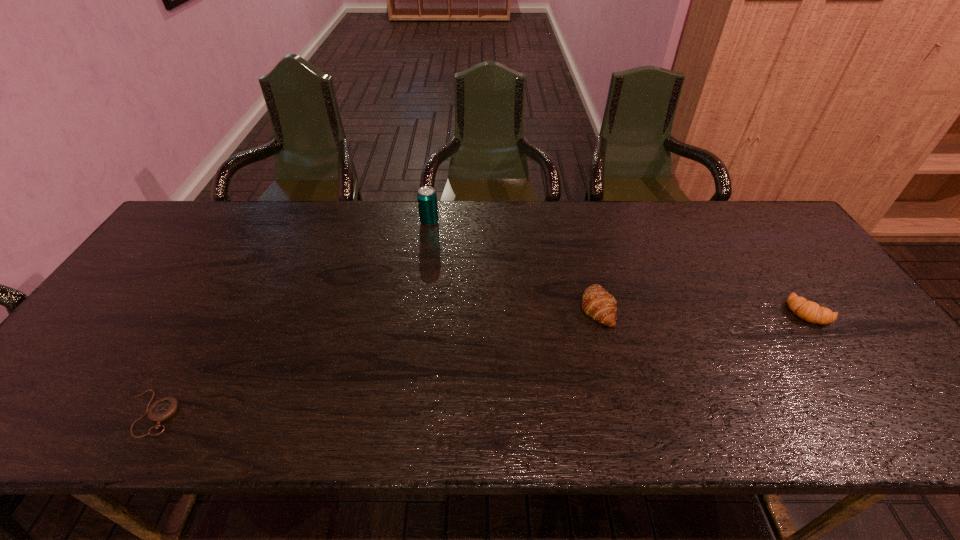
At what (x,y) coordinates should I click in order to perform the action: click on the farthest object. Please return your answer as a coordinate pair (x, y). Looking at the image, I should click on (427, 198).

Image resolution: width=960 pixels, height=540 pixels. I want to click on the tallest object, so click(x=427, y=198).

This screenshot has height=540, width=960. Identify the location of the taller crescent roll. (598, 304).

Locate an element on the screen. The height and width of the screenshot is (540, 960). the left crescent roll is located at coordinates (598, 304).

Locate an element on the screen. The image size is (960, 540). the shorter crescent roll is located at coordinates (809, 311).

Identify the location of the right crescent roll. This screenshot has width=960, height=540. (809, 311).

Find the location of a particular element. The width and height of the screenshot is (960, 540). the leftmost object is located at coordinates (163, 409).

Identify the location of the nearest object. (163, 409).

Where is `vacant space situated 0.160m on the left of the tallest object`? This screenshot has height=540, width=960. vacant space situated 0.160m on the left of the tallest object is located at coordinates (371, 222).

Identify the location of vacant space located 0.340m on the back of the left crescent roll. The height and width of the screenshot is (540, 960). (574, 215).